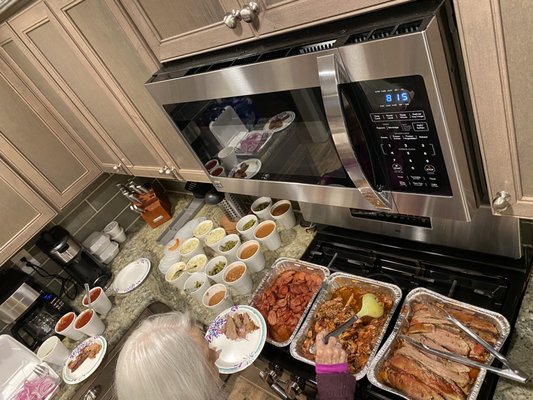
Find the location of a particular element. knives is located at coordinates (159, 213).